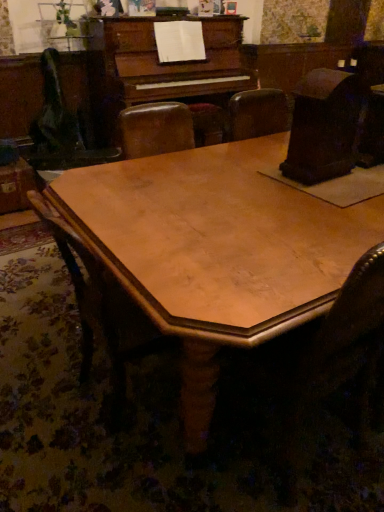
This screenshot has width=384, height=512. Describe the element at coordinates (101, 308) in the screenshot. I see `wooden chair at center` at that location.

Locate an element on the screen. The height and width of the screenshot is (512, 384). wooden chair at center is located at coordinates (101, 308).

Measure the distance between wooden table at center and camera.

wooden table at center is 36.24 inches from camera.

Where is `wooden table at center`? wooden table at center is located at coordinates (216, 249).

What do you see at coordinates (216, 249) in the screenshot?
I see `wooden table at center` at bounding box center [216, 249].

Identify the location of wooden chair at center. (101, 308).

Can you confirm if wooden table at center is positioned to the right of wooden chair at center?

Indeed, wooden table at center is positioned on the right side of wooden chair at center.

Which object is further away from the camera taking this photo, wooden table at center or wooden chair at center?

wooden chair at center is further away from the camera.

Is point (168, 231) positioned in front of point (90, 295)?

Yes, it is.

From the image's perspective, which object appears higher, wooden table at center or wooden chair at center?

wooden table at center is shown above in the image.

Based on the photo, from a real-world perspective, is wooden table at center positioned above or below wooden chair at center?

From a real-world perspective, wooden table at center is physically below wooden chair at center.

Which of these two, wooden table at center or wooden chair at center, is thinner?

wooden chair at center is thinner.

Can you confirm if wooden table at center is shorter than wooden chair at center?

Yes.

Is wooden table at center smaller than wooden chair at center?

Incorrect, wooden table at center is not smaller in size than wooden chair at center.

Is wooden table at center not inside wooden chair at center?

wooden table at center lies outside wooden chair at center's area.

Would you consider wooden table at center to be distant from wooden chair at center?

No, wooden table at center is not far from wooden chair at center.

Does wooden table at center turn towards wooden chair at center?

No, wooden table at center is not oriented towards wooden chair at center.

Locate an element on the screen. table that is on the right side of wooden chair at center is located at coordinates (216, 249).

Based on their positions, is wooden chair at center located to the left or right of wooden table at center?

Based on their positions, wooden chair at center is located to the left of wooden table at center.

Is wooden chair at center positioned in front of wooden table at center?

No, wooden chair at center is behind wooden table at center.

Which is nearer, (112, 360) or (243, 185)?

Point (112, 360).

From the image's perspective, is wooden chair at center over wooden table at center?

No.

From a real-world perspective, is wooden chair at center located higher than wooden table at center?

Yes.

Does wooden chair at center have a greater width compared to wooden table at center?

No, wooden chair at center is not wider than wooden table at center.

Who is taller, wooden chair at center or wooden table at center?

Standing taller between the two is wooden chair at center.

Considering the relative sizes of wooden chair at center and wooden table at center in the image provided, is wooden chair at center bigger than wooden table at center?

No, wooden chair at center is not bigger than wooden table at center.

Is wooden chair at center inside the boundaries of wooden table at center, or outside?

wooden chair at center is spatially positioned inside wooden table at center.

Is wooden chair at center beside wooden table at center?

They are not placed beside each other.

Could you tell me if wooden chair at center is facing wooden table at center?

Yes, wooden chair at center is aimed at wooden table at center.

What's the angular difference between wooden chair at center and wooden table at center's facing directions?

There is a 1.95-degree angle between the facing directions of wooden chair at center and wooden table at center.

What are the coordinates of `chair below the wooden table at center (from the image's perspective)` in the screenshot? It's located at (101, 308).

At what (x,y) coordinates should I click in order to perform the action: click on table lying above the wooden chair at center (from the image's perspective). Please return your answer as a coordinate pair (x, y). This screenshot has width=384, height=512. Looking at the image, I should click on (216, 249).

The width and height of the screenshot is (384, 512). I want to click on chair on the left of wooden table at center, so click(101, 308).